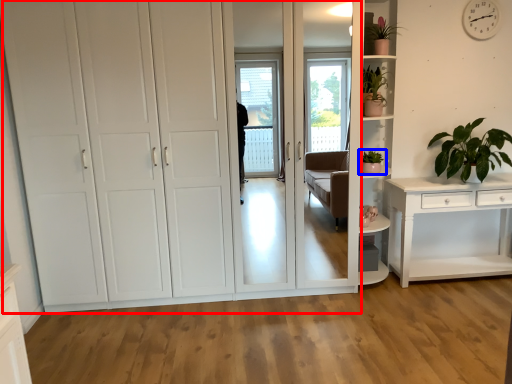
Question: Which of the following is the farthest to the observer, cupboard (highlighted by a red box) or houseplant (highlighted by a blue box)?

Choices:
 (A) cupboard
 (B) houseplant

Answer: (B)